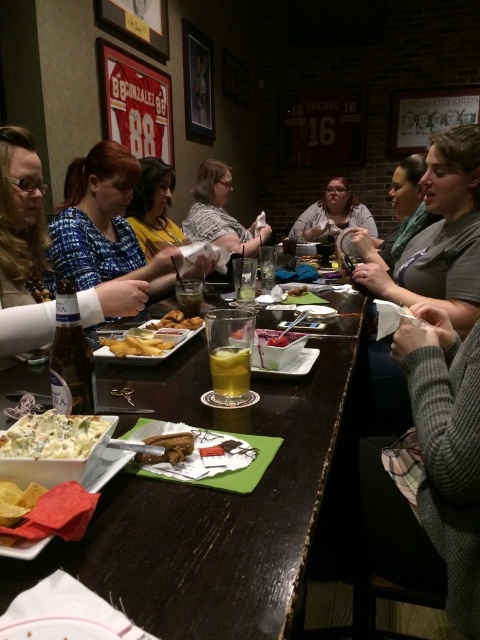
Can you confirm if yellow tortilla chips at lower left is positioned to the left of brown crumbly breadsticks at center?

Indeed, yellow tortilla chips at lower left is positioned on the left side of brown crumbly breadsticks at center.

Consider the image. Between yellow tortilla chips at lower left and brown crumbly breadsticks at center, which one has less height?

brown crumbly breadsticks at center is shorter.

Which is behind, point (32, 506) or point (178, 440)?

Positioned behind is point (178, 440).

This screenshot has height=640, width=480. What are the coordinates of `yellow tortilla chips at lower left` in the screenshot? It's located at (15, 506).

Locate an element on the screen. wooden table at center is located at coordinates (228, 500).

Can you confirm if wooden table at center is positioned to the left of matte gray sweater at center?

Indeed, wooden table at center is positioned on the left side of matte gray sweater at center.

Identify the location of wooden table at center. The width and height of the screenshot is (480, 640). (228, 500).

Can you confirm if wooden table at center is smaller than matte black phone at center?

Incorrect, wooden table at center is not smaller in size than matte black phone at center.

Can you confirm if wooden table at center is bigger than matte black phone at center?

Yes, wooden table at center is bigger than matte black phone at center.

Who is more forward, (350,404) or (159,234)?

Point (350,404) is in front.

Find the location of a particular element. The height and width of the screenshot is (640, 480). wooden table at center is located at coordinates (228, 500).